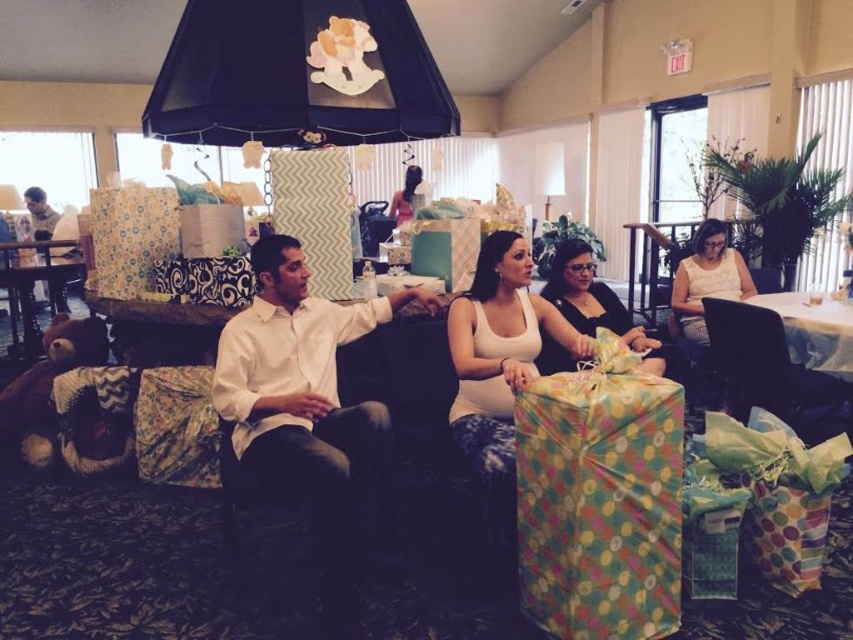
Question: Is matte black dress at center to the right of matte pink dress at center from the viewer's perspective?

Choices:
 (A) yes
 (B) no

Answer: (A)

Question: Does matte white tank top at center have a larger size compared to matte black armchair at lower right?

Choices:
 (A) yes
 (B) no

Answer: (B)

Question: Which point appears closest to the camera in this image?

Choices:
 (A) click(229, 440)
 (B) click(238, 365)
 (C) click(462, 356)
 (D) click(692, 253)

Answer: (B)

Question: Does multicolored paper gift at center appear on the right side of matte black dress at center?

Choices:
 (A) no
 (B) yes

Answer: (A)

Question: Which point is closer to the camera taking this photo?

Choices:
 (A) (397, 202)
 (B) (380, 300)
 (C) (662, 612)

Answer: (C)

Question: Based on their relative distances, which object is nearer to the matte black dress at center?

Choices:
 (A) matte black armchair at lower right
 (B) wooden table at left
 (C) velvet dark brown chair at center
 (D) white smooth shirt at center

Answer: (A)